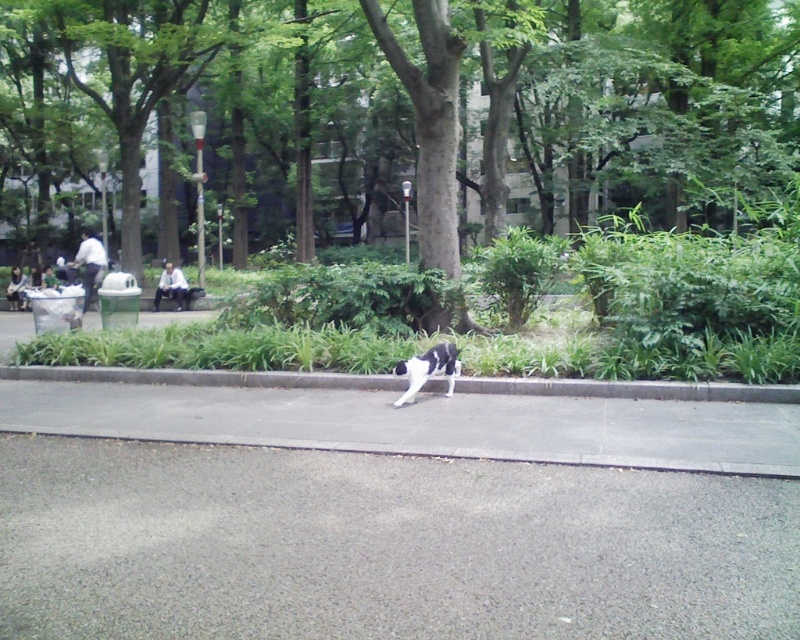
Between point (264, 211) and point (78, 374), which one is positioned behind?

Positioned behind is point (264, 211).

Is green leafy tree at center shorter than gray concrete curb at lower center?

No.

Between point (478, 49) and point (132, 380), which one is positioned in front?

Positioned in front is point (132, 380).

Where is `green leafy tree at center`? green leafy tree at center is located at coordinates (404, 108).

Is green leafy tree at center below gray asphalt pavement at lower center?

Incorrect, green leafy tree at center is not positioned below gray asphalt pavement at lower center.

What do you see at coordinates (404, 108) in the screenshot? I see `green leafy tree at center` at bounding box center [404, 108].

Locate an element on the screen. This screenshot has width=800, height=640. green leafy tree at center is located at coordinates (404, 108).

Can you confirm if gray asphalt pavement at lower center is bigger than black-and-white fur cat at center?

Indeed, gray asphalt pavement at lower center has a larger size compared to black-and-white fur cat at center.

Can you confirm if gray asphalt pavement at lower center is smaller than black-and-white fur cat at center?

Actually, gray asphalt pavement at lower center might be larger than black-and-white fur cat at center.

Between point (392, 564) and point (398, 397), which one is positioned in front?

Point (392, 564)

Locate an element on the screen. The height and width of the screenshot is (640, 800). gray asphalt pavement at lower center is located at coordinates (382, 545).